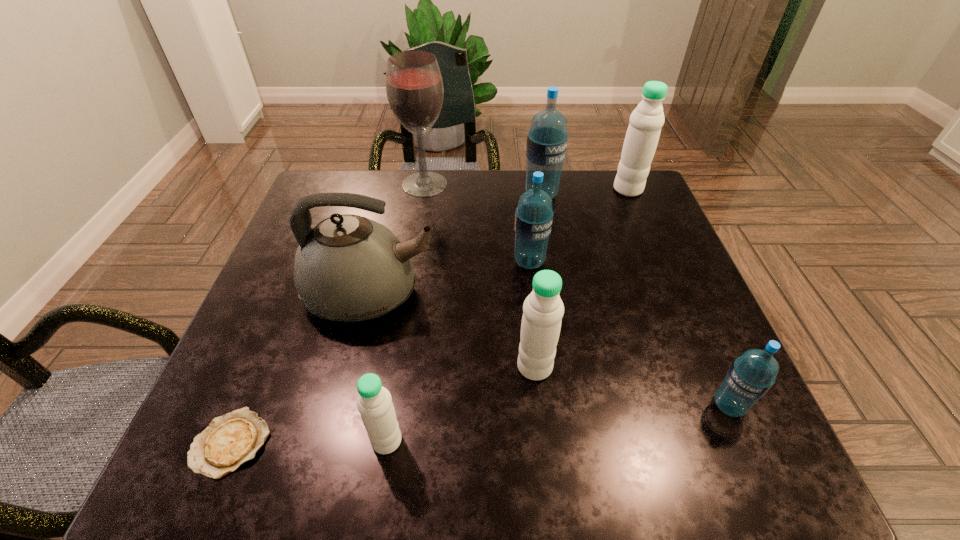
Where is `the smallest blue water bottle`? the smallest blue water bottle is located at coordinates (751, 375).

Identify the location of the nearest white water bottle. The height and width of the screenshot is (540, 960). (374, 403).

Find the location of `the leftmost white water bottle`. the leftmost white water bottle is located at coordinates (374, 403).

This screenshot has width=960, height=540. I want to click on the shortest object, so click(x=230, y=440).

This screenshot has width=960, height=540. Identify the location of brown quiche. (230, 440).

I want to click on free space located 0.210m on the right of the alcohol, so click(521, 184).

I want to click on vacant space located 0.080m on the left of the biggest white water bottle, so click(x=586, y=190).

Locate an element on the screen. The height and width of the screenshot is (540, 960). free spot located on the left of the farthest blue water bottle is located at coordinates (438, 195).

You are a GUI agent. You are given a task and a screenshot of the screen. Output one action in this format:
    pyautogui.click(x=<x>, y=<y>)
    Task: Click on the vacant space located at the spout of the gray kettle
    The height and width of the screenshot is (540, 960).
    Given the screenshot: What is the action you would take?
    pyautogui.click(x=466, y=294)

This screenshot has height=540, width=960. I want to click on free space located 0.110m on the front of the second biggest white water bottle, so click(x=542, y=440).